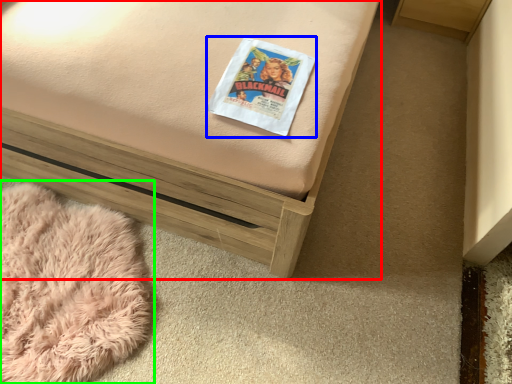
Question: Which is farther away from furniture (highlighted by a red box)? paperback book (highlighted by a blue box) or blanket (highlighted by a green box)?

Choices:
 (A) paperback book
 (B) blanket

Answer: (B)